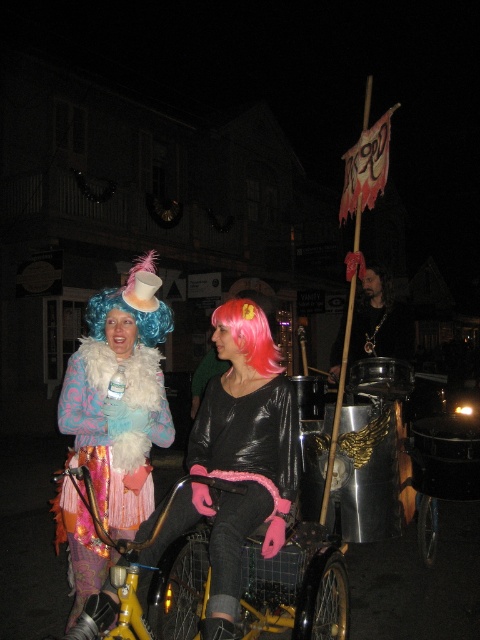
You are a photographer standing at the back of the street scene. You want to take a photo that includes both the yellow metallic bicycle at center and the pinkhair at center. Which object should you focus on first to ensure both are in clear view?

The yellow metallic bicycle at center is closer to the viewer than the pinkhair at center. To ensure both are in clear view, focus on the yellow metallic bicycle at center first, as it is closer, and the depth of field will help keep the pinkhair at center in focus as well.

You are a photographer trying to capture both the glossy black jacket at center and the shiny black shirt at center in a single frame. Since they are both at the center, which one should you position your camera to focus on first to ensure both are in the frame?

You should focus on the glossy black jacket at center first because it is to the left of the shiny black shirt at center, so adjusting the frame to include the left side ensures both are captured.